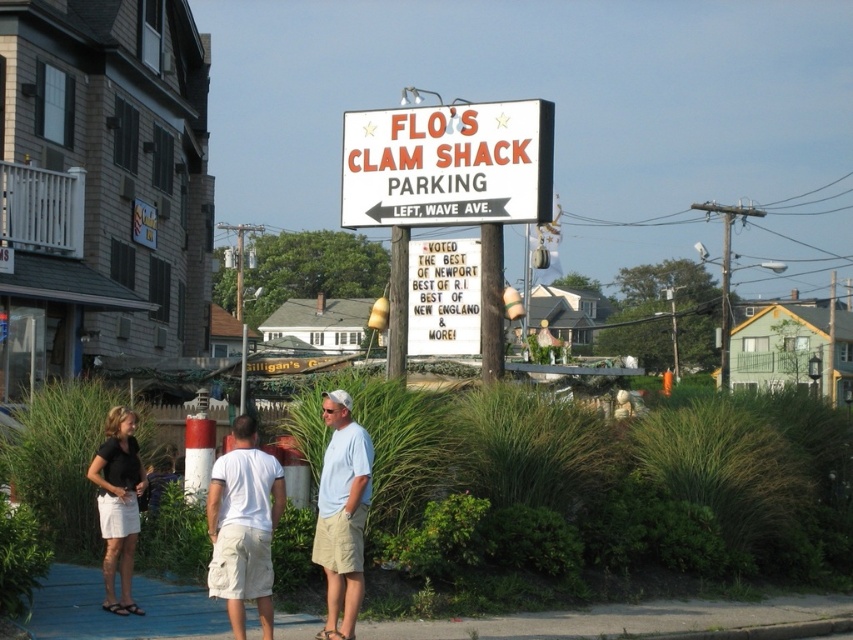
You are standing at the entrance of Flo s Clam Shack and want to know how far you are from the point marked (364, 429). Can you determine the distance?

The point marked (364, 429) is 12.46 meters away from you.

From the picture: You are standing in front of Flo s Clam Shack and need to locate two specific points marked on the sign. The first point is at coordinate point [453,208] and the second is at point [236,554]. Which point is closer to you?

Point [453,208] is closer to you because it is further to the viewer than point [236,554].